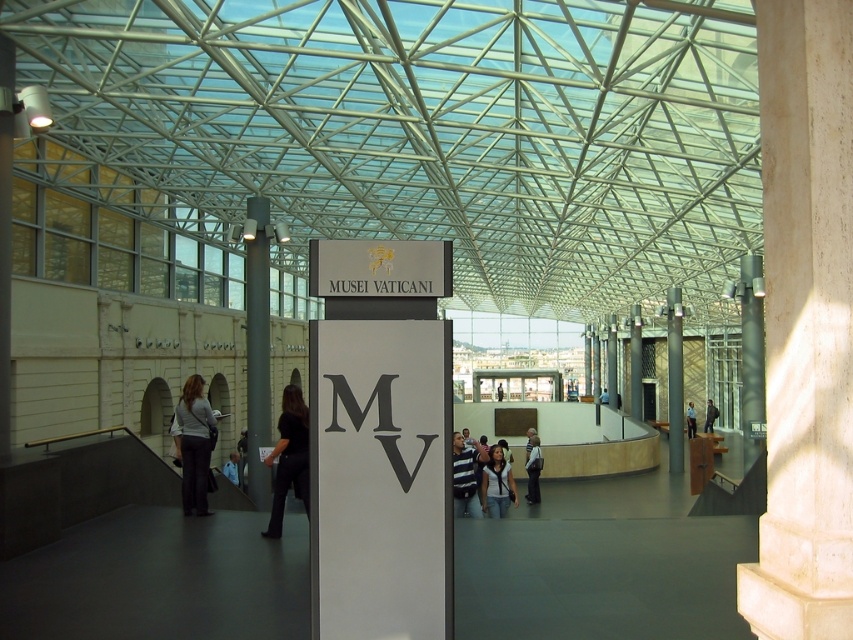
Is metallic gold sign at center to the left of smooth stone pillar at center from the viewer's perspective?

Correct, you'll find metallic gold sign at center to the left of smooth stone pillar at center.

Which is behind, point (358, 253) or point (635, 326)?

Point (635, 326)

Which is in front, point (370, 280) or point (631, 390)?

Point (370, 280) is in front.

What are the coordinates of `metallic gold sign at center` in the screenshot? It's located at (380, 268).

Measure the distance from dark gray fabric pants at center to dark blue shirt at center.

dark gray fabric pants at center is 29.56 meters away from dark blue shirt at center.

Does dark gray fabric pants at center appear on the right side of dark blue shirt at center?

Incorrect, dark gray fabric pants at center is not on the right side of dark blue shirt at center.

What do you see at coordinates (241, 456) in the screenshot? I see `dark gray fabric pants at center` at bounding box center [241, 456].

I want to click on dark gray fabric pants at center, so click(241, 456).

Is the position of metallic gold sign at center less distant than that of light blue jeans at center?

Yes, it is in front of light blue jeans at center.

Is point (426, 291) closer to viewer compared to point (498, 486)?

Yes, it is.

At what (x,y) coordinates should I click in order to perform the action: click on metallic gold sign at center. Please return your answer as a coordinate pair (x, y). Looking at the image, I should click on (380, 268).